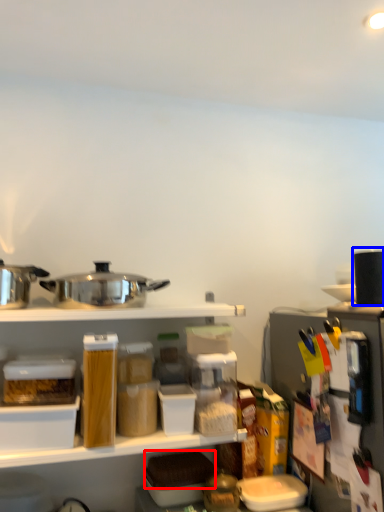
Question: Which object is further to the camera taking this photo, food (highlighted by a red box) or appliance (highlighted by a blue box)?

Choices:
 (A) food
 (B) appliance

Answer: (A)